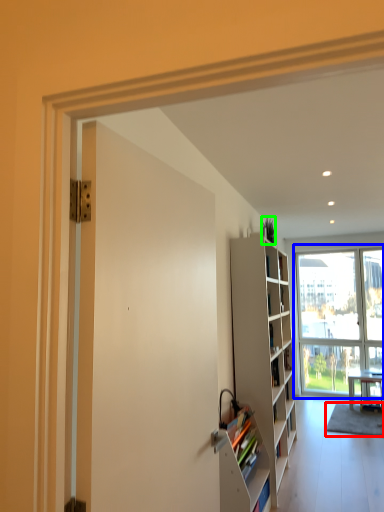
Question: Which object is the farthest from carpets (highlighted by a red box)? Choose among these: window (highlighted by a blue box) or houseplant (highlighted by a green box).

Choices:
 (A) window
 (B) houseplant

Answer: (B)